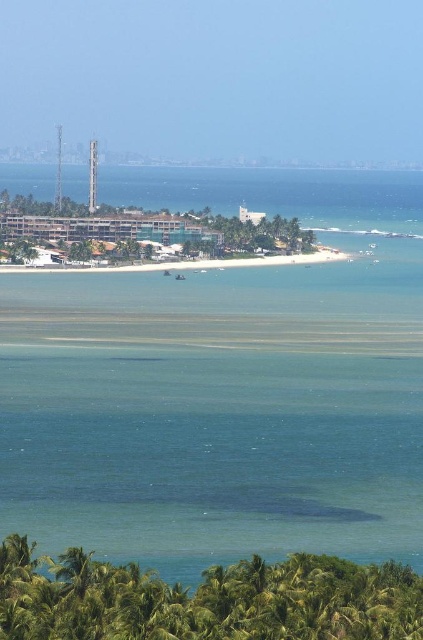
You are standing on the white sand beach at center and want to reach the clear blue water at center. Based on the scene, which direction should you walk to get to the water?

Since the clear blue water at center is closer to the viewer than the white sand beach at center, you should walk towards the direction where the water is nearer. However, according to the scene description, the water is in the middle ground while the beach is also at center. This might mean you need to walk forward towards the water which is slightly closer in the scene.

Consider the image. You are standing on the white sand beach at center and want to reach the clear blue water at center. Based on the scene, which direction should you move to get there?

The clear blue water at center is below the white sand beach at center, so you should move downward to reach it.